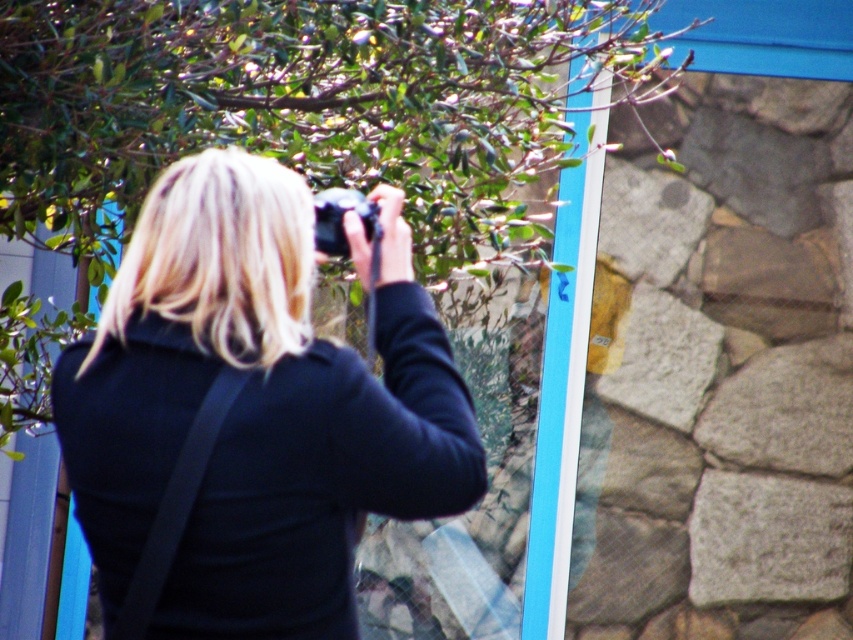
Can you confirm if black matte camera at upper center is positioned to the right of black plastic camera at center?

Incorrect, black matte camera at upper center is not on the right side of black plastic camera at center.

Does black matte camera at upper center lie behind black plastic camera at center?

No, it is not.

Does point (230, 179) come closer to viewer compared to point (347, 195)?

Yes, it is in front of point (347, 195).

Where is `black matte camera at upper center`? The height and width of the screenshot is (640, 853). black matte camera at upper center is located at coordinates pos(256,406).